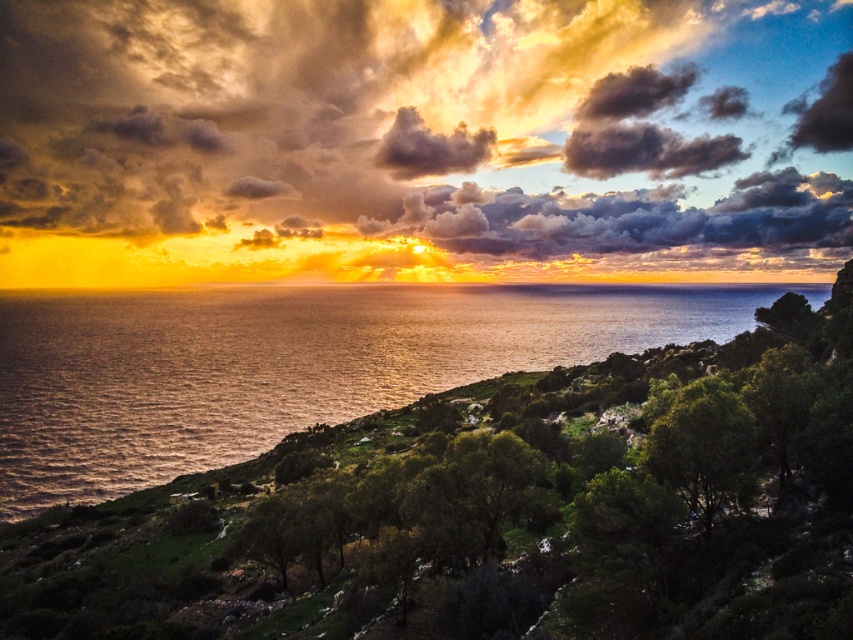
Question: Which point is closer to the camera?

Choices:
 (A) golden textured clouds at upper center
 (B) shiny metallic water at center
 (C) smokey gray cloud at upper center

Answer: (B)

Question: Is shiny metallic water at center to the left of green leafy tree at lower right from the viewer's perspective?

Choices:
 (A) yes
 (B) no

Answer: (B)

Question: Which of the following is the closest to the observer?

Choices:
 (A) smokey gray cloud at upper center
 (B) golden textured clouds at upper center
 (C) shiny metallic water at center

Answer: (C)

Question: Which of the following is the closest to the observer?

Choices:
 (A) green leafy tree at lower right
 (B) smokey gray cloud at upper center
 (C) golden textured clouds at upper center
 (D) shiny metallic water at center

Answer: (A)

Question: Is shiny metallic water at center thinner than green leafy tree at lower right?

Choices:
 (A) yes
 (B) no

Answer: (B)

Question: Is golden textured clouds at upper center wider than smokey gray cloud at upper center?

Choices:
 (A) yes
 (B) no

Answer: (A)